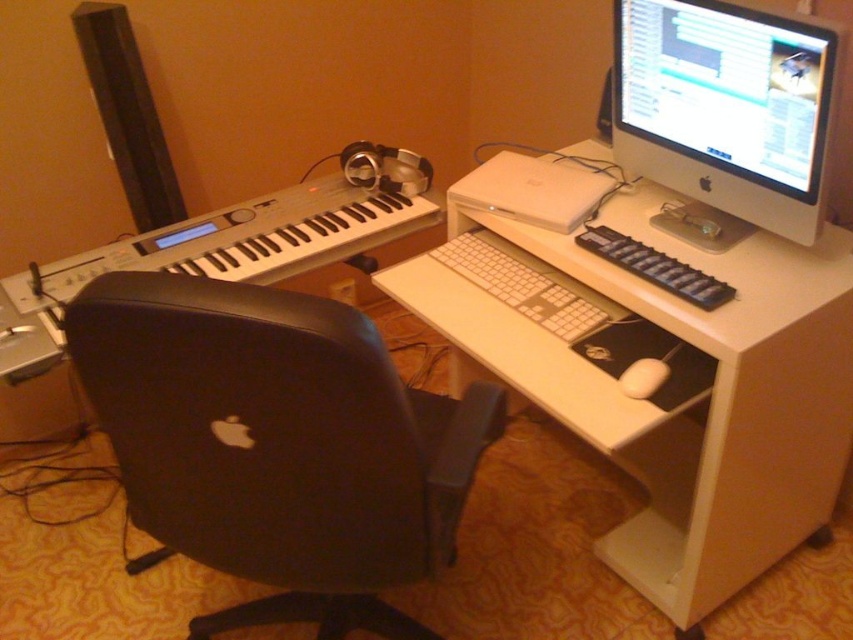
You are a delivery person trying to place a small package on the desk. The package is 10 cm wide. There is space between the black leather swivel chair at center and the white matte mouse at lower right. Can the package fit in that space?

The black leather swivel chair at center might be wider than the white matte mouse at lower right, so the space between them may not be wide enough for the 10 cm package. Check the exact dimensions before placing it.

You are a person sitting in the black office chair with Apple logo and want to reach the white matte mouse at lower right. Is the satin silver monitor at upper right blocking your way?

The satin silver monitor at upper right is in front of the white matte mouse at lower right, so it is blocking your path to the mouse.

You are organizing your desk and want to place a new keyboard between the white plastic laptop at center and the white matte mouse at lower right. Since the laptop is covering the mouse, where should you move the laptop to make space for the keyboard?

The white plastic laptop at center is positioned over white matte mouse at lower right, so you should move the laptop away from the mouse to create space for the keyboard between them.